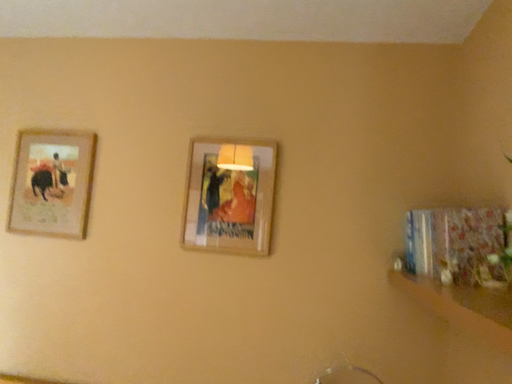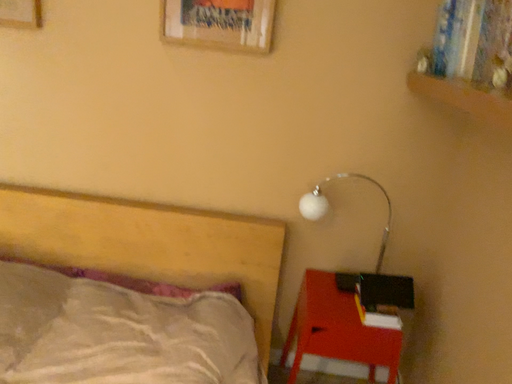
Question: How did the camera likely rotate when shooting the video?

Choices:
 (A) rotated downward
 (B) rotated upward

Answer: (A)